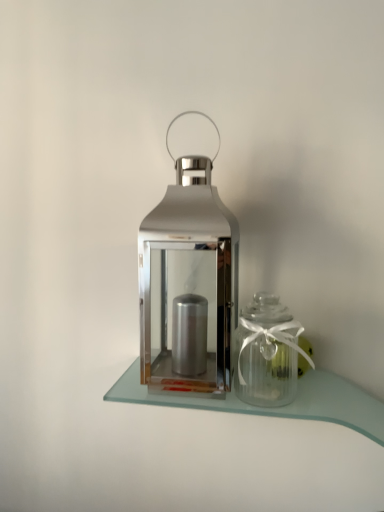
The image size is (384, 512). Find the location of `vacant space underneath clear glass jar at right (from a real-world perspective)`. vacant space underneath clear glass jar at right (from a real-world perspective) is located at coordinates (284, 395).